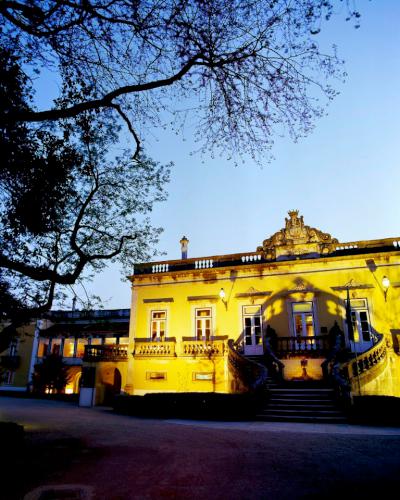
I want to click on 5 windows, so click(x=363, y=312), click(x=307, y=326), click(x=257, y=326), click(x=207, y=328), click(x=157, y=321).